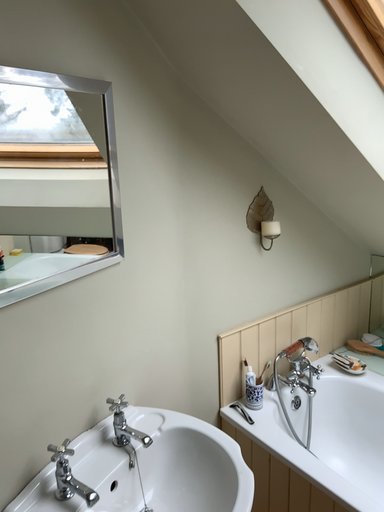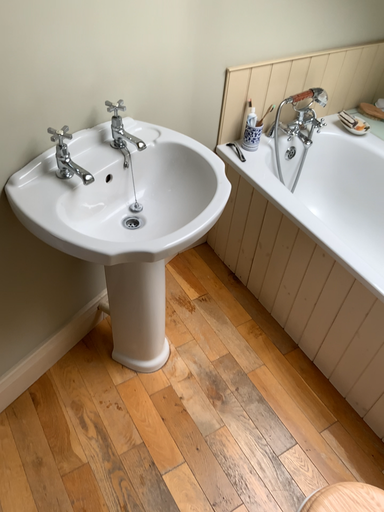
Question: Which way did the camera rotate in the video?

Choices:
 (A) rotated downward
 (B) rotated upward

Answer: (A)